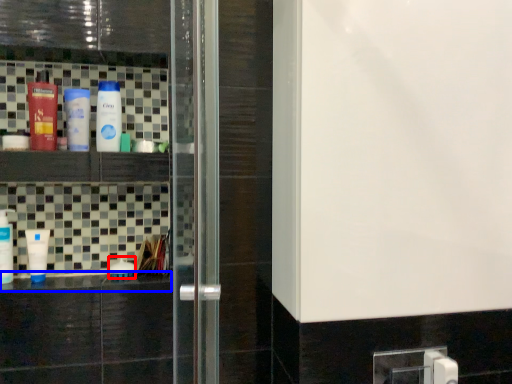
Question: Among these objects, which one is nearest to the camera, bottle (highlighted by a red box) or counter top (highlighted by a blue box)?

Choices:
 (A) bottle
 (B) counter top

Answer: (B)